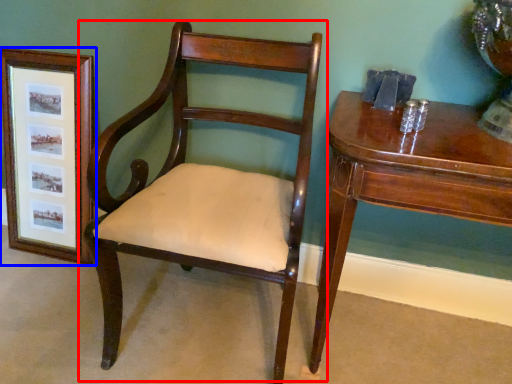
Question: Among these objects, which one is nearest to the camera, chair (highlighted by a red box) or picture frame (highlighted by a blue box)?

Choices:
 (A) chair
 (B) picture frame

Answer: (A)